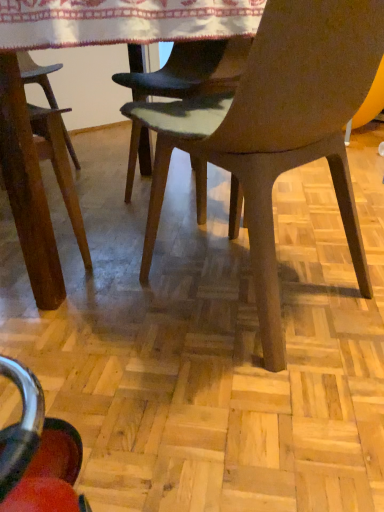
Locate an element on the screen. This screenshot has width=384, height=512. white embroidered tablecloth at upper center is located at coordinates (122, 21).

This screenshot has height=512, width=384. What do you see at coordinates (122, 21) in the screenshot?
I see `white embroidered tablecloth at upper center` at bounding box center [122, 21].

Describe the element at coordinates (275, 132) in the screenshot. I see `matte brown chair at center` at that location.

At what (x,y) coordinates should I click in order to perform the action: click on matte brown chair at center. Please return your answer as a coordinate pair (x, y). The image size is (384, 512). Looking at the image, I should click on (275, 132).

Where is `white embroidered tablecloth at upper center`? This screenshot has width=384, height=512. white embroidered tablecloth at upper center is located at coordinates (122, 21).

Looking at this image, does matte brown chair at center appear on the left side of white embroidered tablecloth at upper center?

In fact, matte brown chair at center is to the right of white embroidered tablecloth at upper center.

Does matte brown chair at center lie behind white embroidered tablecloth at upper center?

No, it is not.

Is point (251, 143) closer or farther from the camera than point (53, 24)?

Point (251, 143) appears to be farther away from the viewer than point (53, 24).

From the image's perspective, between matte brown chair at center and white embroidered tablecloth at upper center, who is located below?

matte brown chair at center is shown below in the image.

From a real-world perspective, which object stands above the other?

white embroidered tablecloth at upper center is physically above.

Can you confirm if matte brown chair at center is wider than white embroidered tablecloth at upper center?

No, matte brown chair at center is not wider than white embroidered tablecloth at upper center.

Can you confirm if matte brown chair at center is taller than white embroidered tablecloth at upper center?

Correct, matte brown chair at center is much taller as white embroidered tablecloth at upper center.

Which of these two, matte brown chair at center or white embroidered tablecloth at upper center, is bigger?

Bigger between the two is matte brown chair at center.

Is matte brown chair at center not within white embroidered tablecloth at upper center?

matte brown chair at center lies outside white embroidered tablecloth at upper center's area.

Is matte brown chair at center in contact with white embroidered tablecloth at upper center?

matte brown chair at center and white embroidered tablecloth at upper center are not in contact.

Is matte brown chair at center facing towards white embroidered tablecloth at upper center?

Yes.

What are the coordinates of `chair that appears in front of the white embroidered tablecloth at upper center` in the screenshot? It's located at (275, 132).

Is white embroidered tablecloth at upper center at the left side of matte brown chair at center?

Yes.

Considering their positions, is white embroidered tablecloth at upper center located in front of or behind matte brown chair at center?

Clearly, white embroidered tablecloth at upper center is behind matte brown chair at center.

Does point (156, 31) come in front of point (273, 250)?

Yes.

From the image's perspective, is white embroidered tablecloth at upper center above matte brown chair at center?

Correct, white embroidered tablecloth at upper center appears higher than matte brown chair at center in the image.

From a real-world perspective, does white embroidered tablecloth at upper center stand above matte brown chair at center?

Correct, in the physical world, white embroidered tablecloth at upper center is higher than matte brown chair at center.

From the picture: Does white embroidered tablecloth at upper center have a greater width compared to matte brown chair at center?

Yes, white embroidered tablecloth at upper center is wider than matte brown chair at center.

Who is shorter, white embroidered tablecloth at upper center or matte brown chair at center?

With less height is white embroidered tablecloth at upper center.

Does white embroidered tablecloth at upper center have a smaller size compared to matte brown chair at center?

Indeed, white embroidered tablecloth at upper center has a smaller size compared to matte brown chair at center.

Would you say white embroidered tablecloth at upper center is outside matte brown chair at center?

Yes, white embroidered tablecloth at upper center is located beyond the bounds of matte brown chair at center.

Is white embroidered tablecloth at upper center directly adjacent to matte brown chair at center?

No, white embroidered tablecloth at upper center is not next to matte brown chair at center.

Is white embroidered tablecloth at upper center oriented towards matte brown chair at center?

Yes, white embroidered tablecloth at upper center is turned towards matte brown chair at center.

Locate an element on the screen. The height and width of the screenshot is (512, 384). chair below the white embroidered tablecloth at upper center (from a real-world perspective) is located at coordinates (275, 132).

This screenshot has height=512, width=384. I want to click on tablecloth above the matte brown chair at center (from a real-world perspective), so click(122, 21).

You are a GUI agent. You are given a task and a screenshot of the screen. Output one action in this format:
    pyautogui.click(x=<x>, y=<y>)
    Task: Click on the tablecloth located behind the matte brown chair at center
    This screenshot has height=512, width=384.
    Given the screenshot: What is the action you would take?
    pyautogui.click(x=122, y=21)